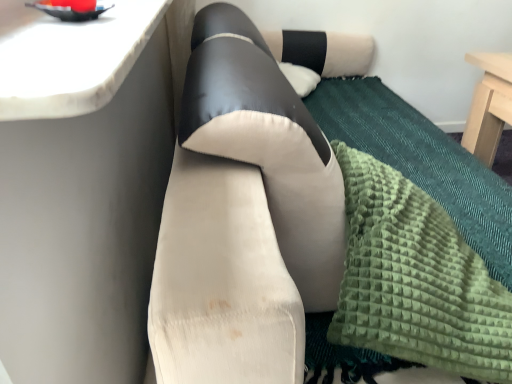
Question: Considering the relative sizes of suede-like beige couch at center and white marble countertop at upper left in the image provided, is suede-like beige couch at center thinner than white marble countertop at upper left?

Choices:
 (A) no
 (B) yes

Answer: (A)

Question: Considering the relative positions of suede-like beige couch at center and white marble countertop at upper left in the image provided, is suede-like beige couch at center to the right of white marble countertop at upper left from the viewer's perspective?

Choices:
 (A) yes
 (B) no

Answer: (A)

Question: Is suede-like beige couch at center wider than white marble countertop at upper left?

Choices:
 (A) yes
 (B) no

Answer: (A)

Question: From the image's perspective, is suede-like beige couch at center beneath white marble countertop at upper left?

Choices:
 (A) yes
 (B) no

Answer: (A)

Question: From a real-world perspective, is suede-like beige couch at center located beneath white marble countertop at upper left?

Choices:
 (A) no
 (B) yes

Answer: (B)

Question: Looking at the image, does green textured blanket at lower right seem bigger or smaller compared to suede-like beige couch at center?

Choices:
 (A) small
 (B) big

Answer: (A)

Question: Relative to suede-like beige couch at center, is green textured blanket at lower right in front or behind?

Choices:
 (A) behind
 (B) front

Answer: (A)

Question: Considering the positions of green textured blanket at lower right and suede-like beige couch at center in the image, is green textured blanket at lower right taller or shorter than suede-like beige couch at center?

Choices:
 (A) tall
 (B) short

Answer: (B)

Question: Is green textured blanket at lower right situated inside suede-like beige couch at center or outside?

Choices:
 (A) outside
 (B) inside

Answer: (B)

Question: From their relative heights in the image, would you say white marble countertop at upper left is taller or shorter than suede-like beige couch at center?

Choices:
 (A) tall
 (B) short

Answer: (B)

Question: From a real-world perspective, is white marble countertop at upper left positioned above or below suede-like beige couch at center?

Choices:
 (A) above
 (B) below

Answer: (A)

Question: Do you think white marble countertop at upper left is within suede-like beige couch at center, or outside of it?

Choices:
 (A) inside
 (B) outside

Answer: (B)

Question: Is white marble countertop at upper left bigger or smaller than suede-like beige couch at center?

Choices:
 (A) small
 (B) big

Answer: (A)

Question: In terms of width, does suede-like beige couch at center look wider or thinner when compared to white marble countertop at upper left?

Choices:
 (A) thin
 (B) wide

Answer: (B)

Question: Does point (x=279, y=319) appear closer or farther from the camera than point (x=119, y=52)?

Choices:
 (A) farther
 (B) closer

Answer: (B)